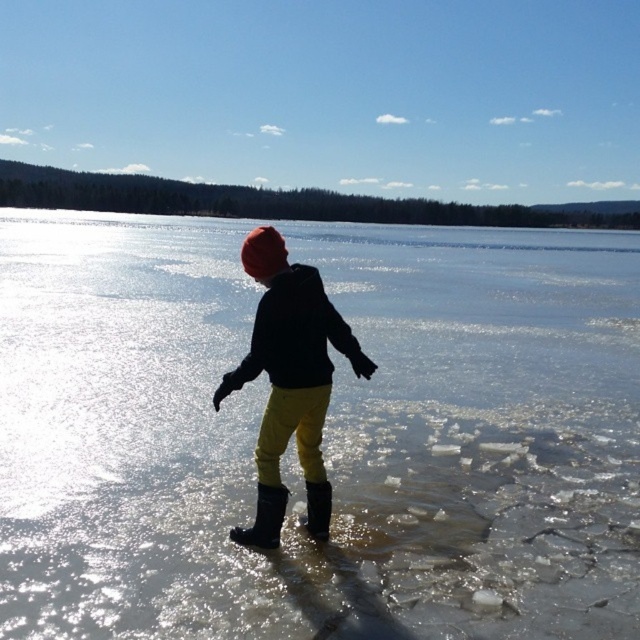
Question: Is transparent ice at center bigger than rubber boots at center?

Choices:
 (A) yes
 (B) no

Answer: (A)

Question: Which point is closer to the camera taking this photo?

Choices:
 (A) (323, 520)
 (B) (240, 536)

Answer: (B)

Question: Is the position of yellow matte pants at center more distant than that of black matte jacket at center?

Choices:
 (A) no
 (B) yes

Answer: (B)

Question: Which point is farther from the camera taking this photo?

Choices:
 (A) (257, 509)
 (B) (260, 275)
 (C) (266, 340)

Answer: (A)

Question: Which point is farther to the camera?

Choices:
 (A) (212, 515)
 (B) (348, 342)
 (C) (257, 540)

Answer: (A)

Question: Does black matte jacket at center appear on the left side of rubber boots at center?

Choices:
 (A) yes
 (B) no

Answer: (B)